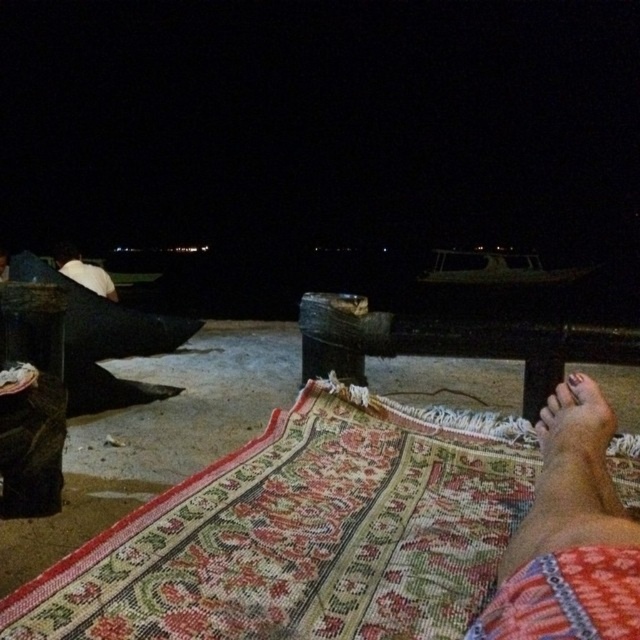
Question: Among these objects, which one is farthest from the camera?

Choices:
 (A) white matte umbrella at upper left
 (B) brown textured foot at lower right

Answer: (A)

Question: Does brown textured foot at lower right appear under white matte umbrella at upper left?

Choices:
 (A) no
 (B) yes

Answer: (B)

Question: Which point is closer to the camera?

Choices:
 (A) brown textured foot at lower right
 (B) white matte umbrella at upper left

Answer: (A)

Question: Is brown textured foot at lower right to the left of white matte umbrella at upper left from the viewer's perspective?

Choices:
 (A) yes
 (B) no

Answer: (B)

Question: Where is brown textured foot at lower right located in relation to white matte umbrella at upper left in the image?

Choices:
 (A) right
 (B) left

Answer: (A)